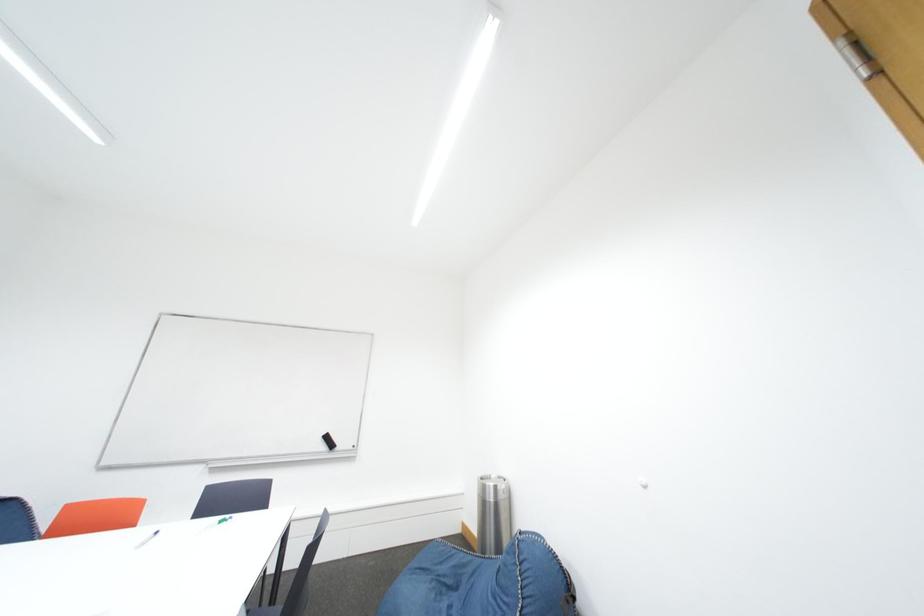
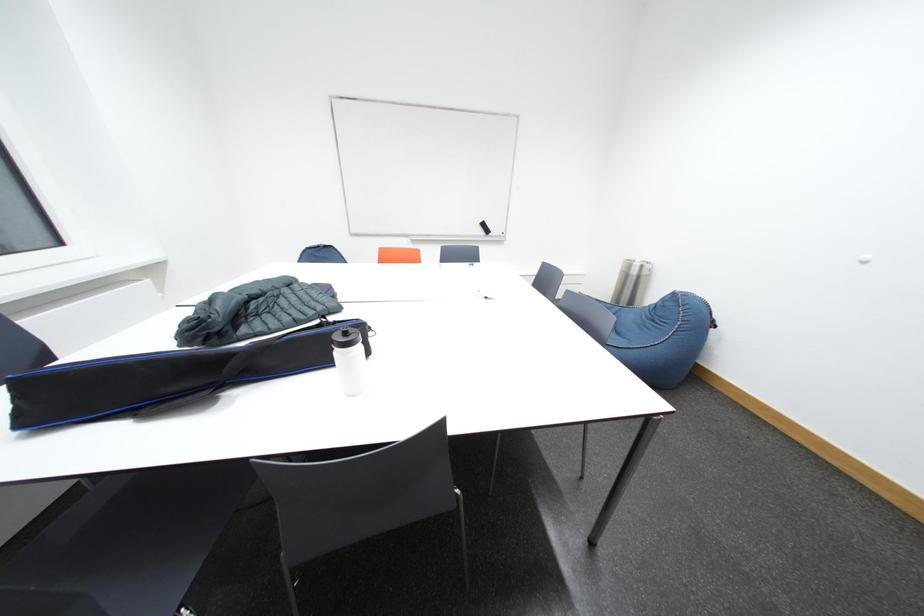
How did the camera likely rotate?

The rotation direction of the camera is left-down.